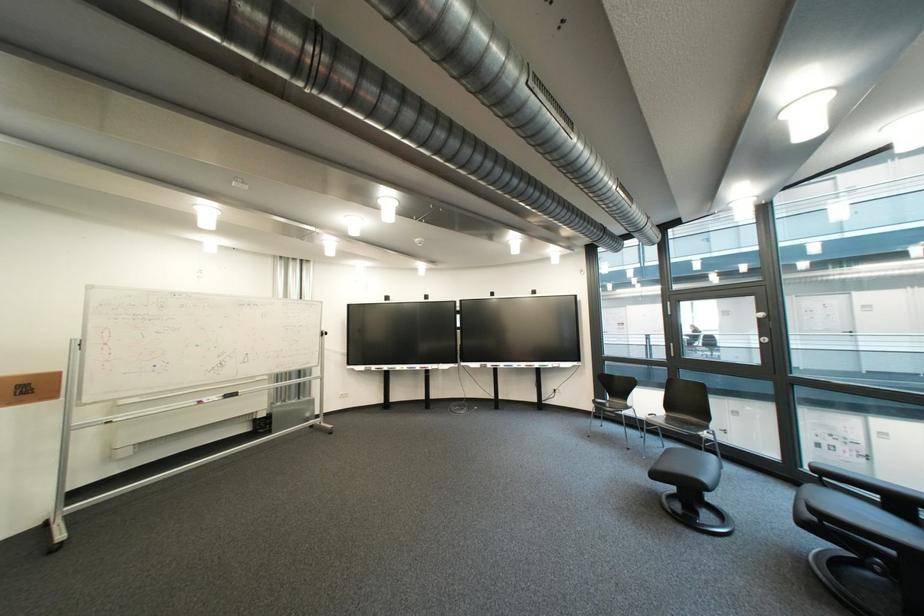
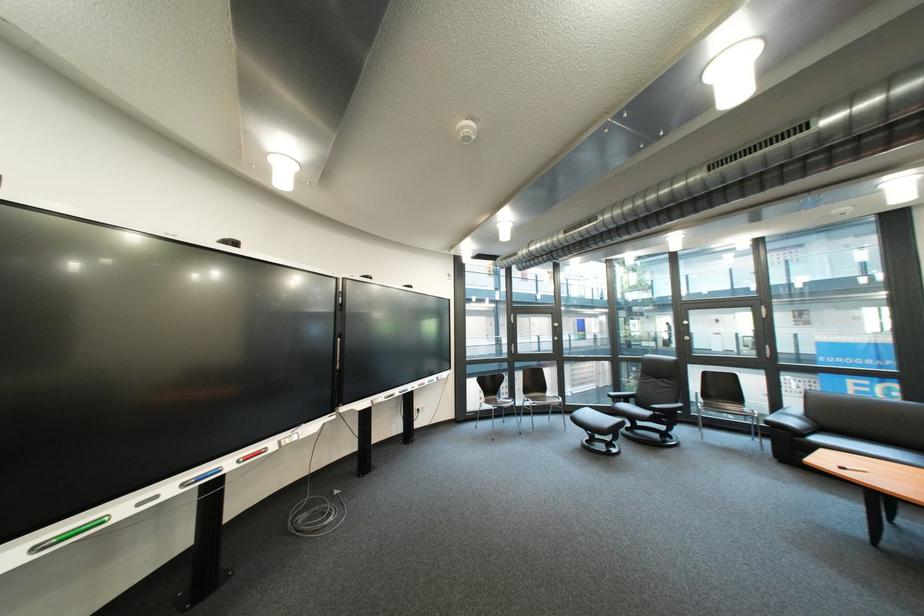
Locate, in the second image, the point that corresponds to point (839, 524) in the first image.

(670, 415)